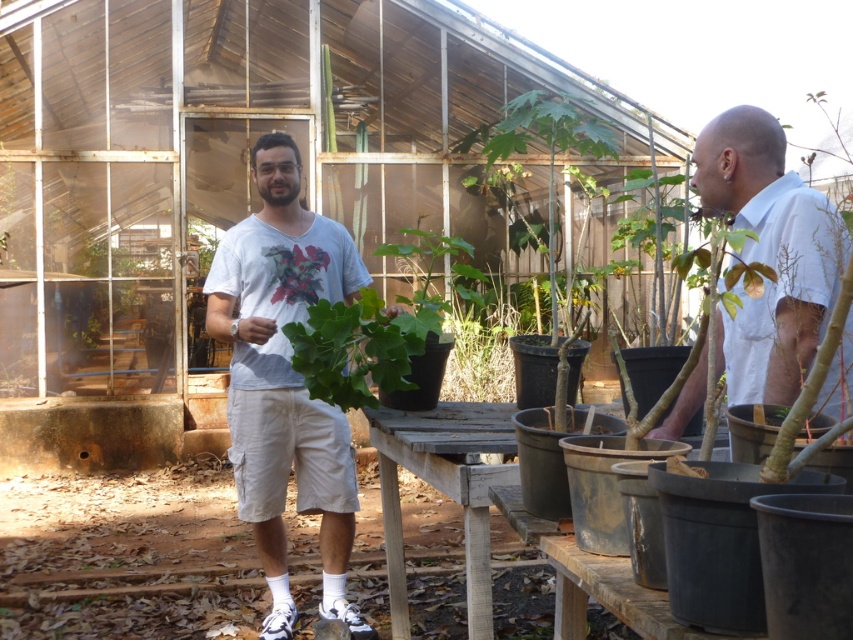
Is white cotton t-shirt at center positioned in front of white matte shirt at right?

No, white cotton t-shirt at center is behind white matte shirt at right.

Who is more distant from viewer, (271, 332) or (732, 369)?

Point (271, 332)

Image resolution: width=853 pixels, height=640 pixels. In order to click on white cotton t-shirt at center in this screenshot , I will do `click(285, 378)`.

This screenshot has width=853, height=640. Identify the location of white cotton t-shirt at center. (285, 378).